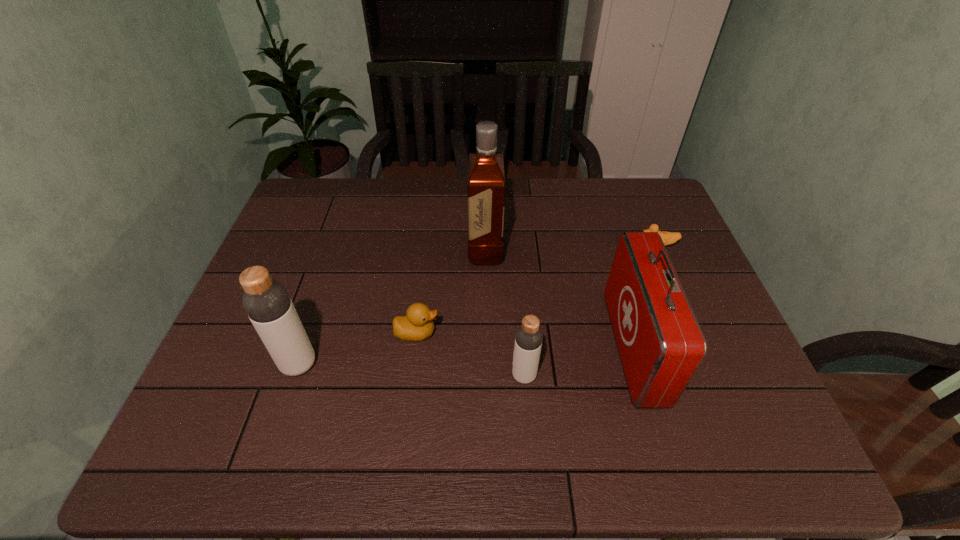
Find the location of `vacant region that satisfies the following two spatial constraints: 1. on the back side of the third shortest object; 2. on the face of the fifth tallest object`. vacant region that satisfies the following two spatial constraints: 1. on the back side of the third shortest object; 2. on the face of the fifth tallest object is located at coordinates pos(520,333).

The width and height of the screenshot is (960, 540). I want to click on vacant space that satisfies the following two spatial constraints: 1. on the face of the right duckling; 2. on the front side of the third shortest object, so click(x=710, y=376).

Find the location of `free space that satisfies the following two spatial constraints: 1. on the front label of the tallest object; 2. on the left side of the fourth tallest object`. free space that satisfies the following two spatial constraints: 1. on the front label of the tallest object; 2. on the left side of the fourth tallest object is located at coordinates (487, 376).

Where is `vacant space that satisfies the following two spatial constraints: 1. on the face of the left duckling; 2. on the back side of the fourth object from left to right`? vacant space that satisfies the following two spatial constraints: 1. on the face of the left duckling; 2. on the back side of the fourth object from left to right is located at coordinates (411, 376).

Locate an element on the screen. vacant space that satisfies the following two spatial constraints: 1. on the front label of the liquor; 2. on the front side of the taller bottle is located at coordinates (487, 364).